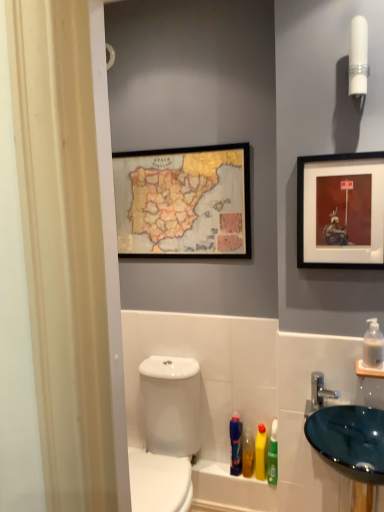
Identify the location of vacant space that is to the left of translucent green mouthwash at lower right, arranged as the 2th mouthwash when viewed from the top. (216, 465).